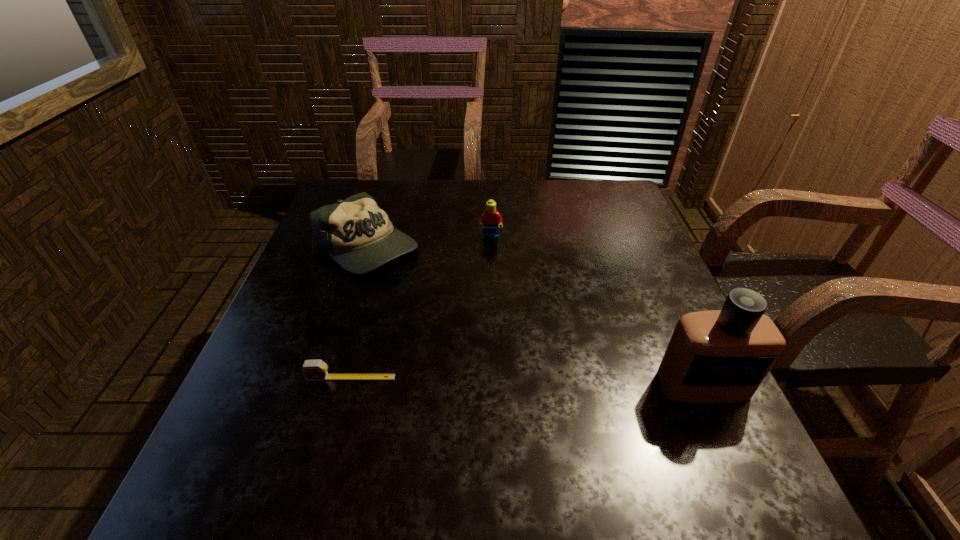
Locate an element on the screen. The image size is (960, 540). free location at the far edge is located at coordinates (396, 211).

In the image, there is a desktop. In order to click on vacant space at the near edge in this screenshot , I will do `click(486, 404)`.

Locate an element on the screen. This screenshot has width=960, height=540. vacant space at the right edge is located at coordinates (631, 255).

In order to click on free region at the near left corner of the desktop in this screenshot , I will do `click(211, 445)`.

In order to click on vacant area at the far right corner in this screenshot , I will do `click(609, 202)`.

In the image, there is a desktop. Where is `vacant space at the near right corner`? vacant space at the near right corner is located at coordinates (715, 413).

Locate an element on the screen. This screenshot has width=960, height=540. blank region between the Lego and the tape measure is located at coordinates (420, 308).

This screenshot has height=540, width=960. In order to click on vacant area that lies between the tape measure and the Lego in this screenshot , I will do `click(420, 308)`.

Find the location of `free space between the baseball cap and the shortest object`. free space between the baseball cap and the shortest object is located at coordinates (359, 313).

This screenshot has height=540, width=960. Find the location of `vacant area that lies between the Lego and the tape measure`. vacant area that lies between the Lego and the tape measure is located at coordinates (420, 308).